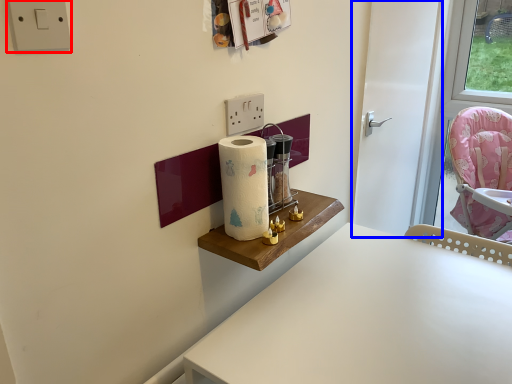
Question: Which of the following is the farthest to the observer, electric outlet (highlighted by a red box) or door (highlighted by a blue box)?

Choices:
 (A) electric outlet
 (B) door

Answer: (B)